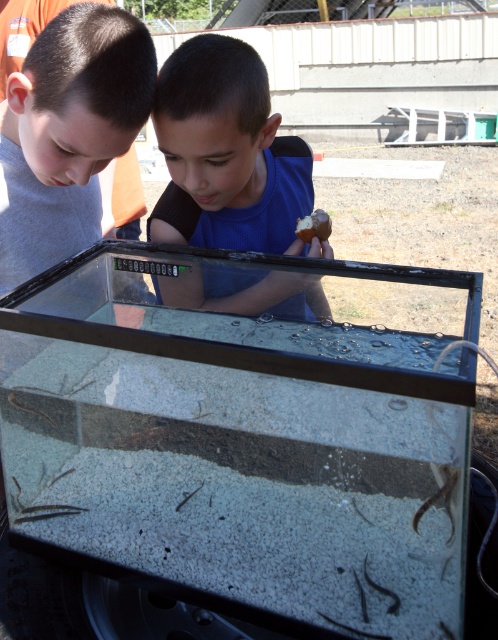
Between transparent glass tank at center and brown matte potato at center, which one has more height?

Standing taller between the two is transparent glass tank at center.

Who is higher up, transparent glass tank at center or brown matte potato at center?

brown matte potato at center is above.

The image size is (498, 640). Find the location of `transparent glass tank at center`. transparent glass tank at center is located at coordinates (241, 444).

You are a GUI agent. You are given a task and a screenshot of the screen. Output one action in this format:
    pyautogui.click(x=<x>, y=<y>)
    Task: Click on the blue matte shirt at center
    Image resolution: width=498 pixels, height=640 pixels.
    Given the screenshot: What is the action you would take?
    pyautogui.click(x=228, y=154)

Which of these two, blue matte shirt at center or brown matte potato at center, stands taller?

With more height is blue matte shirt at center.

Who is more forward, (315, 282) or (297, 236)?

Point (315, 282) is more forward.

Image resolution: width=498 pixels, height=640 pixels. I want to click on blue matte shirt at center, so click(x=228, y=154).

The height and width of the screenshot is (640, 498). Identify the location of transparent glass tank at center. (241, 444).

Does transparent glass tank at center lie behind blue matte shirt at center?

No.

Which is in front, point (278, 372) or point (184, 129)?

Point (278, 372) is more forward.

Where is `transparent glass tank at center`? This screenshot has height=640, width=498. transparent glass tank at center is located at coordinates (241, 444).